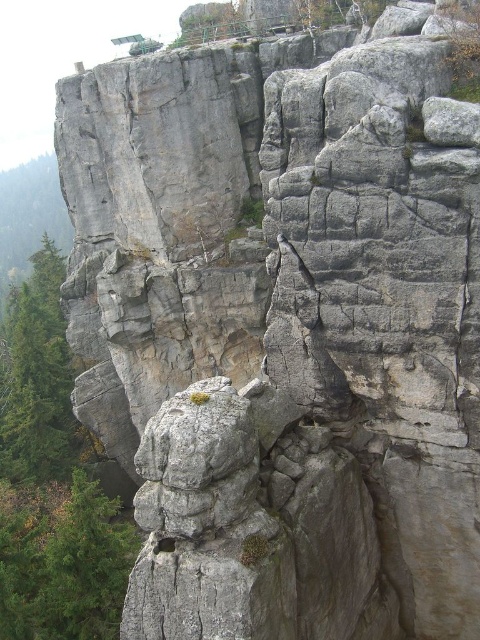
Question: Is the position of green rough tree at lower left more distant than that of green rough tree at left?

Choices:
 (A) yes
 (B) no

Answer: (B)

Question: From the image, what is the correct spatial relationship of green rough tree at lower left in relation to green rough tree at left?

Choices:
 (A) above
 (B) below

Answer: (B)

Question: Which point appears closest to the camera in this image?

Choices:
 (A) (103, 600)
 (B) (56, 307)

Answer: (A)

Question: Does green rough tree at lower left have a greater width compared to green rough tree at left?

Choices:
 (A) no
 (B) yes

Answer: (A)

Question: Which point appears farthest from the camera in this image?

Choices:
 (A) (54, 340)
 (B) (11, 525)

Answer: (A)